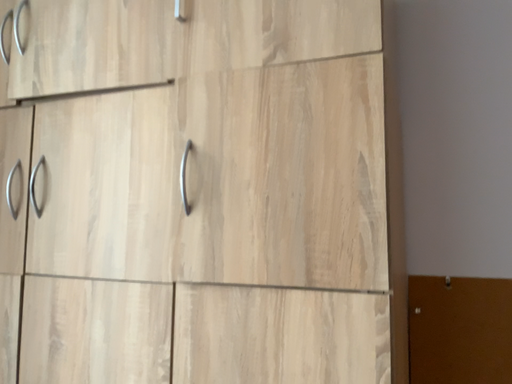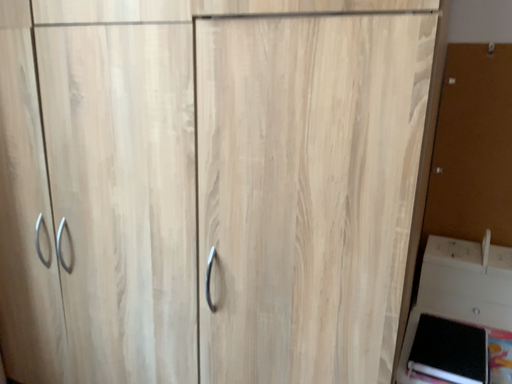
Question: How did the camera likely rotate when shooting the video?

Choices:
 (A) rotated downward
 (B) rotated upward

Answer: (A)